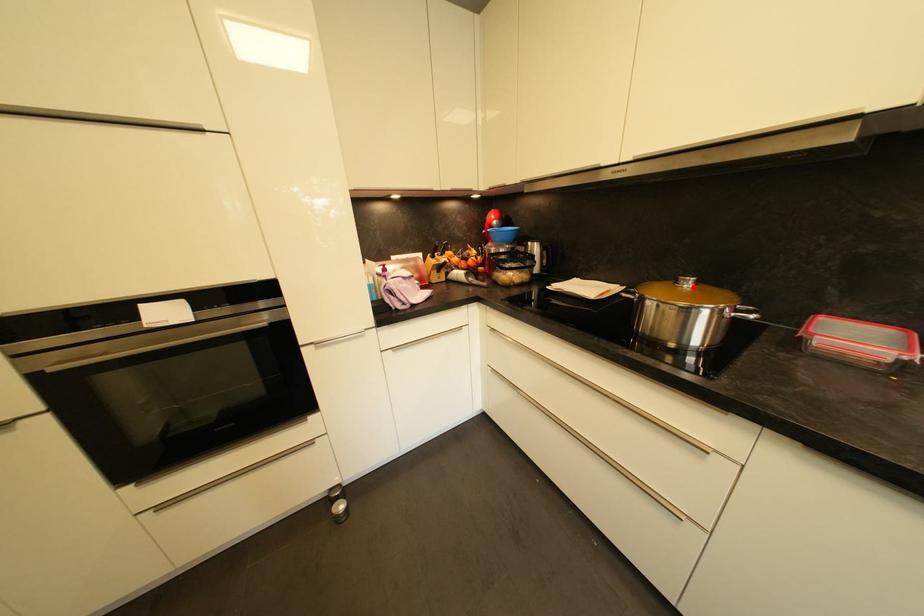
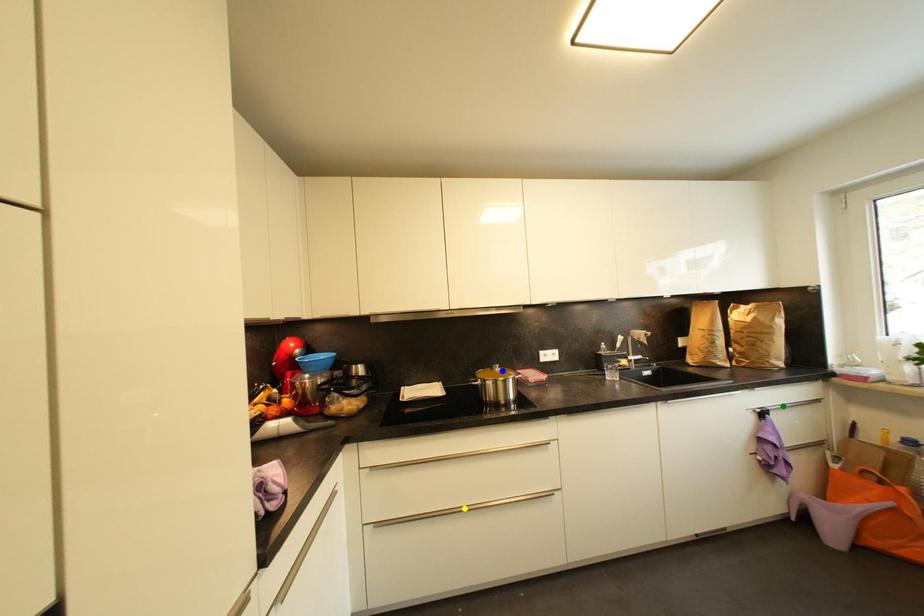
Question: I am providing you with two images of the same scene from different viewpoints. A red point is marked on the first image. You are given multiple points on the second image. In image 2, which mark is for the same physical point as the one in image 1?

Choices:
 (A) yellow point
 (B) green point
 (C) blue point

Answer: (C)